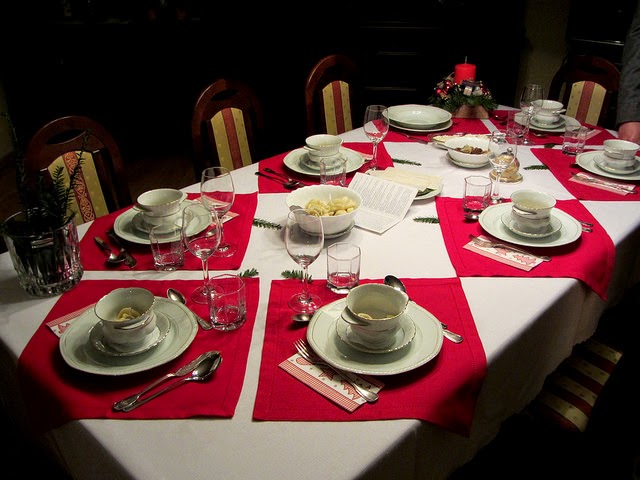
The image size is (640, 480). Identify the location of tops of small soup bowls. (115, 291), (150, 189), (356, 288), (313, 135), (516, 193), (607, 140), (553, 100).